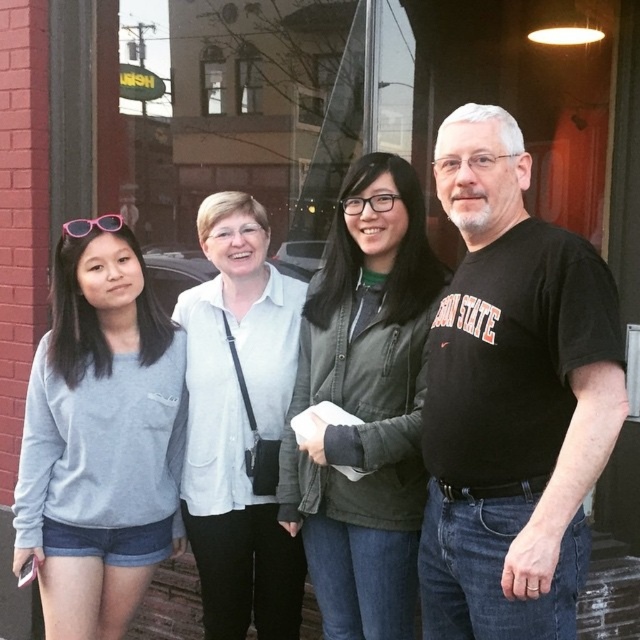
Can you confirm if black cotton t-shirt at center is positioned to the right of white matte shirt at center?

Yes, black cotton t-shirt at center is to the right of white matte shirt at center.

Which of these two, black cotton t-shirt at center or white matte shirt at center, stands taller?

With more height is white matte shirt at center.

Between point (436, 371) and point (211, 582), which one is positioned behind?

The point (211, 582) is behind.

The width and height of the screenshot is (640, 640). What are the coordinates of `black cotton t-shirt at center` in the screenshot? It's located at (512, 397).

Which is above, black cotton t-shirt at center or green matte jacket at center?

Positioned higher is black cotton t-shirt at center.

Can you confirm if black cotton t-shirt at center is positioned to the right of green matte jacket at center?

Correct, you'll find black cotton t-shirt at center to the right of green matte jacket at center.

Is point (518, 467) less distant than point (355, 636)?

Yes, point (518, 467) is closer to viewer.

The image size is (640, 640). I want to click on black cotton t-shirt at center, so click(x=512, y=397).

Does green matte jacket at center lie in front of pink plastic sunglasses at upper left?

Yes.

Does green matte jacket at center have a greater height compared to pink plastic sunglasses at upper left?

Correct, green matte jacket at center is much taller as pink plastic sunglasses at upper left.

Between point (365, 358) and point (122, 220), which one is positioned in front?

Point (365, 358)

Locate an element on the screen. The image size is (640, 640). green matte jacket at center is located at coordinates (364, 404).